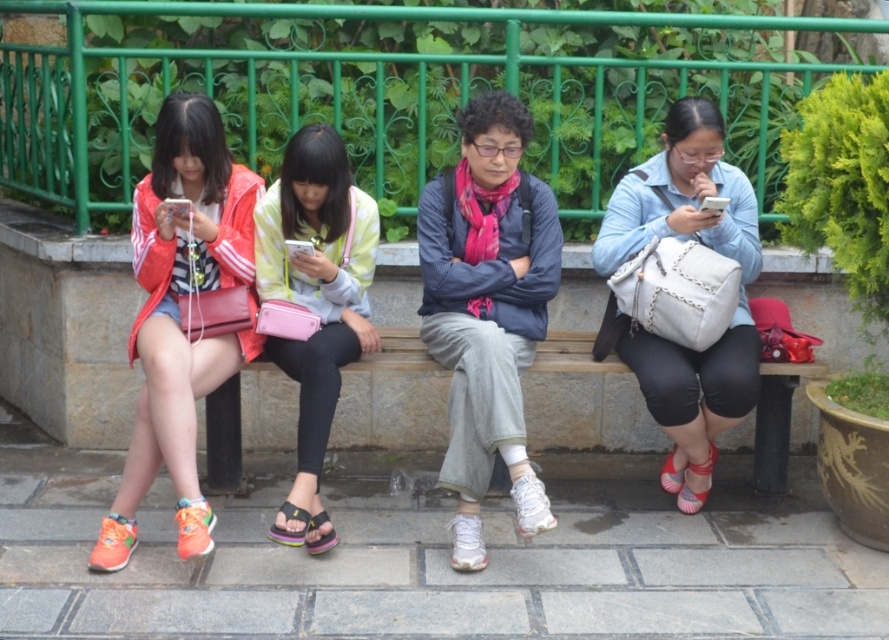
Is pastel yellow jacket at center above multicolored fabric sandal at center?

Yes, pastel yellow jacket at center is above multicolored fabric sandal at center.

Does pastel yellow jacket at center have a lesser height compared to multicolored fabric sandal at center?

No, pastel yellow jacket at center is not shorter than multicolored fabric sandal at center.

Who is more forward, (306, 166) or (308, 515)?

Point (308, 515) is in front.

Identify the location of pastel yellow jacket at center. The image size is (889, 640). (317, 284).

Is matte blue jacket at center above matte pink sandal at lower right?

Indeed, matte blue jacket at center is positioned over matte pink sandal at lower right.

You are a GUI agent. You are given a task and a screenshot of the screen. Output one action in this format:
    pyautogui.click(x=<x>, y=<y>)
    Task: Click on the matte blue jacket at center
    This screenshot has width=889, height=640.
    Given the screenshot: What is the action you would take?
    point(487,310)

Does point (433, 209) come farther from viewer compared to point (717, 458)?

No.

I want to click on matte blue jacket at center, so click(x=487, y=310).

Does point (697, 374) lie behind point (714, 460)?

No, it is in front of (714, 460).

Between light blue denim shirt at center and matte pink sandal at lower right, which one has less height?

With less height is matte pink sandal at lower right.

Is point (733, 177) behind point (703, 465)?

That is True.

The width and height of the screenshot is (889, 640). What are the coordinates of `light blue denim shirt at center` in the screenshot? It's located at (707, 246).